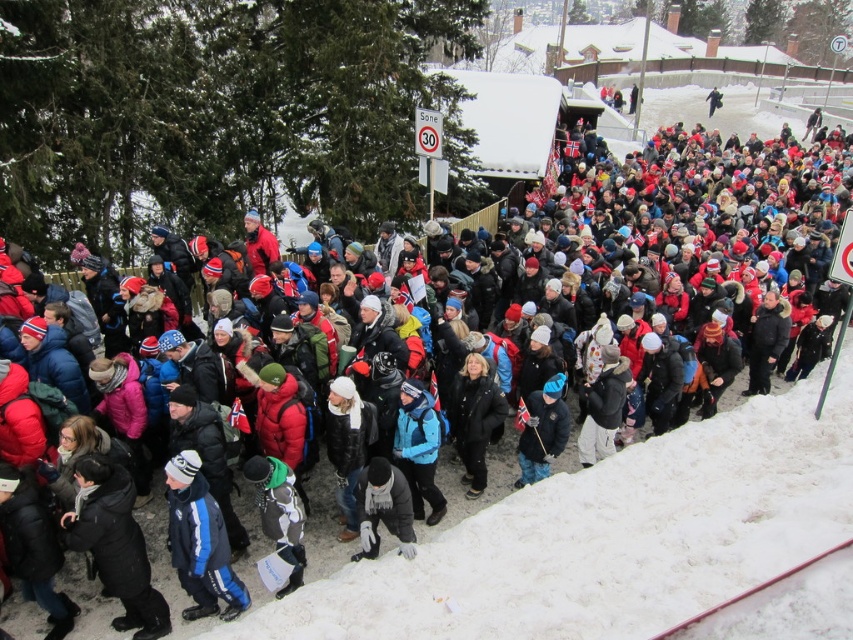
Looking at this image, you are planning to take a photo of the white snow at center and the black matte coat at lower left. Which object will appear smaller in the photo?

The white snow at center will appear smaller in the photo because it has a smaller size compared to the black matte coat at lower left.

You are standing in the winter crowd and want to see the snow at center. Is the white snow at center visible above the blue woolen hat at center?

The white snow at center is shorter than blue woolen hat at center, so it is not visible above the blue woolen hat at center.